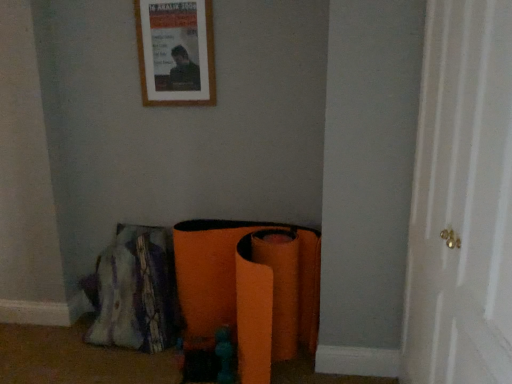
Question: Should I look upward or downward to see white wood door at right?

Choices:
 (A) up
 (B) down

Answer: (B)

Question: Is wooden picture frame at upper center at the right side of white wood door at right?

Choices:
 (A) yes
 (B) no

Answer: (B)

Question: Is wooden picture frame at upper center directly adjacent to white wood door at right?

Choices:
 (A) no
 (B) yes

Answer: (A)

Question: Does wooden picture frame at upper center have a lesser height compared to white wood door at right?

Choices:
 (A) no
 (B) yes

Answer: (B)

Question: Is white wood door at right a part of wooden picture frame at upper center?

Choices:
 (A) yes
 (B) no

Answer: (B)

Question: Considering the relative sizes of wooden picture frame at upper center and white wood door at right in the image provided, is wooden picture frame at upper center smaller than white wood door at right?

Choices:
 (A) no
 (B) yes

Answer: (B)

Question: From the image's perspective, does wooden picture frame at upper center appear lower than white wood door at right?

Choices:
 (A) no
 (B) yes

Answer: (A)

Question: Can we say white wood door at right lies outside wooden picture frame at upper center?

Choices:
 (A) no
 (B) yes

Answer: (B)

Question: Can you confirm if white wood door at right is taller than wooden picture frame at upper center?

Choices:
 (A) yes
 (B) no

Answer: (A)

Question: Does white wood door at right have a smaller size compared to wooden picture frame at upper center?

Choices:
 (A) no
 (B) yes

Answer: (A)

Question: Considering the relative sizes of white wood door at right and wooden picture frame at upper center in the image provided, is white wood door at right bigger than wooden picture frame at upper center?

Choices:
 (A) no
 (B) yes

Answer: (B)

Question: Does white wood door at right appear on the right side of wooden picture frame at upper center?

Choices:
 (A) yes
 (B) no

Answer: (A)

Question: Considering the relative sizes of white wood door at right and wooden picture frame at upper center in the image provided, is white wood door at right shorter than wooden picture frame at upper center?

Choices:
 (A) yes
 (B) no

Answer: (B)

Question: Considering the positions of white wood door at right and wooden picture frame at upper center in the image, is white wood door at right taller or shorter than wooden picture frame at upper center?

Choices:
 (A) tall
 (B) short

Answer: (A)